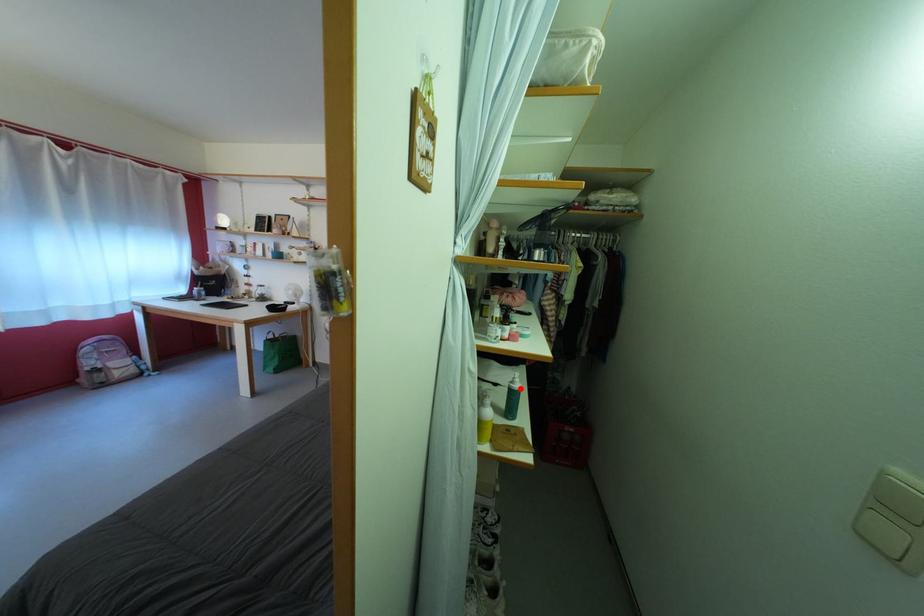
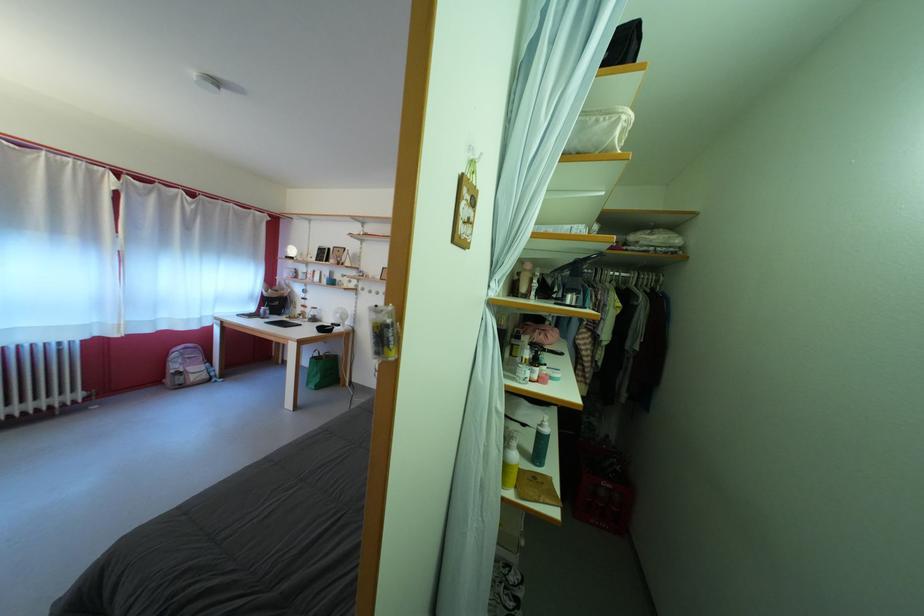
In the second image, find the point that corresponds to the highlighted location in the first image.

(549, 431)